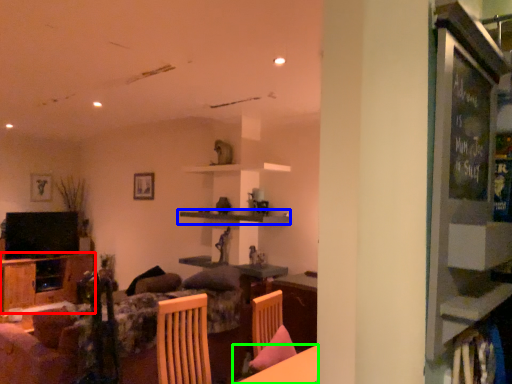
Question: Which is nearer to the cabinetry (highlighted by a red box)? shelf (highlighted by a blue box) or table (highlighted by a green box).

Choices:
 (A) shelf
 (B) table

Answer: (A)